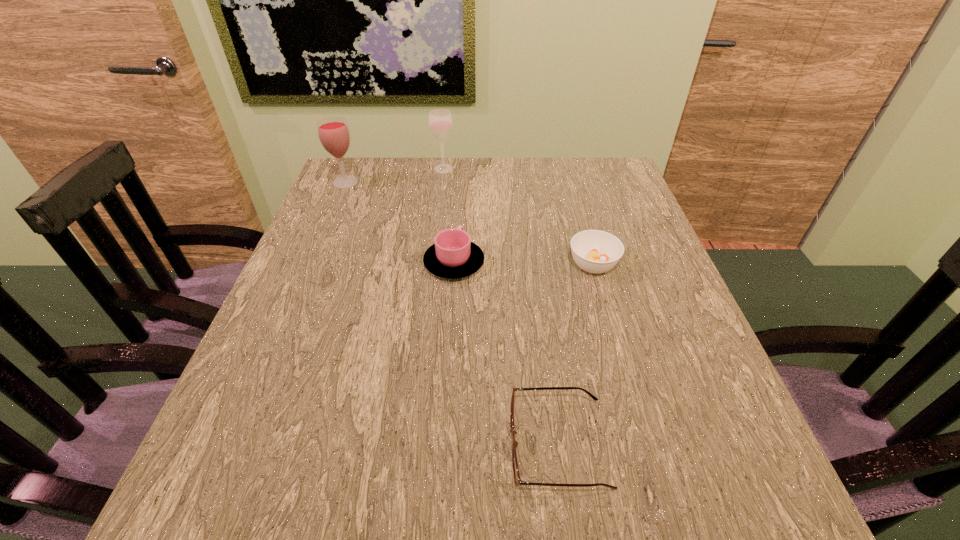
Where is `vacant area that lies between the cup and the fourth object from left to right`? This screenshot has width=960, height=540. vacant area that lies between the cup and the fourth object from left to right is located at coordinates (506, 354).

You are a GUI agent. You are given a task and a screenshot of the screen. Output one action in this format:
    pyautogui.click(x=<x>, y=<y>)
    Task: Click on the empty space that is in between the cup and the farthest object
    Image resolution: width=960 pixels, height=540 pixels.
    Given the screenshot: What is the action you would take?
    pyautogui.click(x=448, y=216)

What are the coordinates of `vacant space that's between the shortest object and the soup bowl` in the screenshot? It's located at (575, 355).

You are a GUI agent. You are given a task and a screenshot of the screen. Output one action in this format:
    pyautogui.click(x=<x>, y=<y>)
    Task: Click on the free space between the nearer wineglass and the soup bowl
    
    Given the screenshot: What is the action you would take?
    pyautogui.click(x=469, y=224)

In order to click on empty location between the nearest object and the leftmost object in this screenshot , I will do `click(452, 314)`.

The width and height of the screenshot is (960, 540). I want to click on vacant area between the spectacles and the farther wineglass, so click(501, 307).

I want to click on free spot between the third shortest object and the right wineglass, so click(448, 216).

The height and width of the screenshot is (540, 960). Find the location of `free space between the left wineglass and the third shortest object`. free space between the left wineglass and the third shortest object is located at coordinates (399, 223).

Select which object appears as the second closest to the shortest object. Please provide its 2D coordinates. Your answer should be formatted as a tuple, i.e. [(x, y)], where the tuple contains the x and y coordinates of a point satisfying the conditions above.

[(594, 251)]

The height and width of the screenshot is (540, 960). Identify the location of object that stands as the second closest to the soup bowl. tap(517, 479).